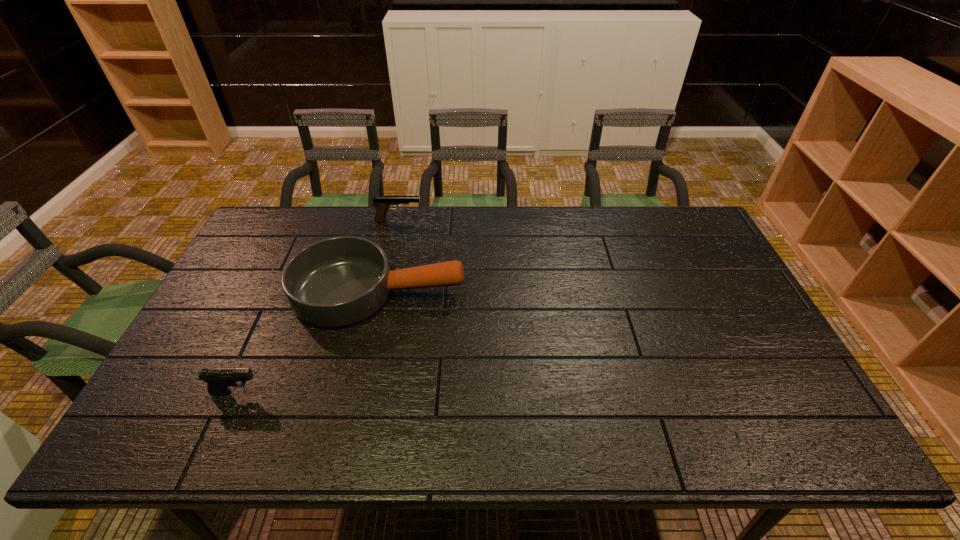
The width and height of the screenshot is (960, 540). In order to click on object that is the second closest one to the nearest object in this screenshot , I will do `click(382, 204)`.

This screenshot has height=540, width=960. In order to click on object that is the closest to the farther pistol in this screenshot , I will do `click(339, 281)`.